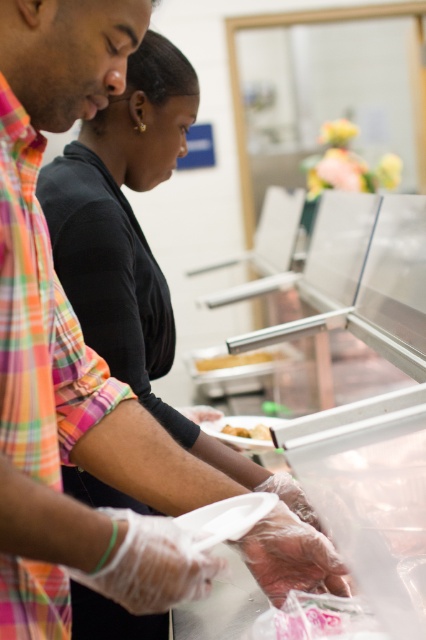
Who is taller, yellow matte tray at center or yellow matte bread at center?

Standing taller between the two is yellow matte tray at center.

Can you confirm if yellow matte tray at center is wider than yellow matte bread at center?

Yes.

Between point (207, 365) and point (238, 433), which one is positioned behind?

The point (207, 365) is more distant.

Where is `yellow matte tray at center`? This screenshot has width=426, height=640. yellow matte tray at center is located at coordinates (238, 358).